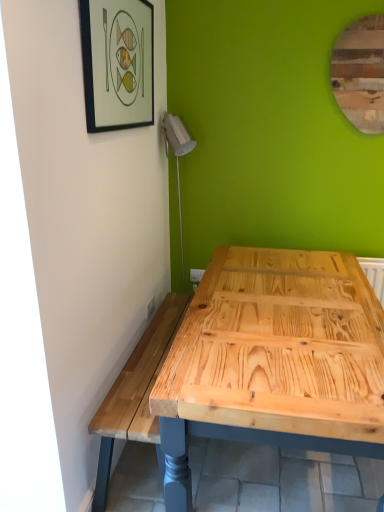
Question: Considering the relative positions of wooden mirror at upper right and matte black picture frame at upper left in the image provided, is wooden mirror at upper right to the left of matte black picture frame at upper left from the viewer's perspective?

Choices:
 (A) yes
 (B) no

Answer: (B)

Question: Is wooden mirror at upper right further to the viewer compared to matte black picture frame at upper left?

Choices:
 (A) no
 (B) yes

Answer: (B)

Question: Is wooden mirror at upper right taller than matte black picture frame at upper left?

Choices:
 (A) no
 (B) yes

Answer: (B)

Question: From a real-world perspective, is wooden mirror at upper right beneath matte black picture frame at upper left?

Choices:
 (A) yes
 (B) no

Answer: (B)

Question: Does wooden mirror at upper right have a larger size compared to matte black picture frame at upper left?

Choices:
 (A) yes
 (B) no

Answer: (B)

Question: From the image's perspective, would you say wooden mirror at upper right is positioned over matte black picture frame at upper left?

Choices:
 (A) no
 (B) yes

Answer: (B)

Question: Considering the relative positions of matte black picture frame at upper left and wooden mirror at upper right in the image provided, is matte black picture frame at upper left to the left of wooden mirror at upper right from the viewer's perspective?

Choices:
 (A) no
 (B) yes

Answer: (B)

Question: Does matte black picture frame at upper left turn towards wooden mirror at upper right?

Choices:
 (A) no
 (B) yes

Answer: (B)

Question: Can you confirm if matte black picture frame at upper left is taller than wooden mirror at upper right?

Choices:
 (A) yes
 (B) no

Answer: (B)

Question: Can you confirm if matte black picture frame at upper left is shorter than wooden mirror at upper right?

Choices:
 (A) no
 (B) yes

Answer: (B)

Question: Is matte black picture frame at upper left positioned in front of wooden mirror at upper right?

Choices:
 (A) yes
 (B) no

Answer: (A)

Question: Is matte black picture frame at upper left oriented away from wooden mirror at upper right?

Choices:
 (A) no
 (B) yes

Answer: (A)

Question: Is point (377, 114) closer or farther from the camera than point (89, 110)?

Choices:
 (A) farther
 (B) closer

Answer: (A)